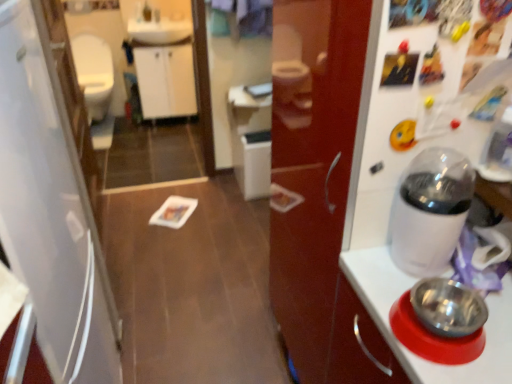
Question: Considering the positions of white glossy toilet bowl at left and white matte refrigerator at left in the image, is white glossy toilet bowl at left taller or shorter than white matte refrigerator at left?

Choices:
 (A) short
 (B) tall

Answer: (A)

Question: From a real-world perspective, is white glossy toilet bowl at left physically located above or below white matte refrigerator at left?

Choices:
 (A) above
 (B) below

Answer: (B)

Question: Considering the real-world distances, which object is closest to the white glossy coffee maker at right?

Choices:
 (A) white glossy toilet bowl at left
 (B) white glossy mirror at upper center
 (C) metallic stainless steel bowl at right
 (D) matte white faucet at upper center
 (E) white glossy sink at upper center

Answer: (C)

Question: Based on their relative distances, which object is farther from the white glossy sink at upper center?

Choices:
 (A) white glossy coffee maker at right
 (B) white glossy mirror at upper center
 (C) metallic stainless steel bowl at right
 (D) white matte refrigerator at left
 (E) white glossy toilet bowl at left

Answer: (C)